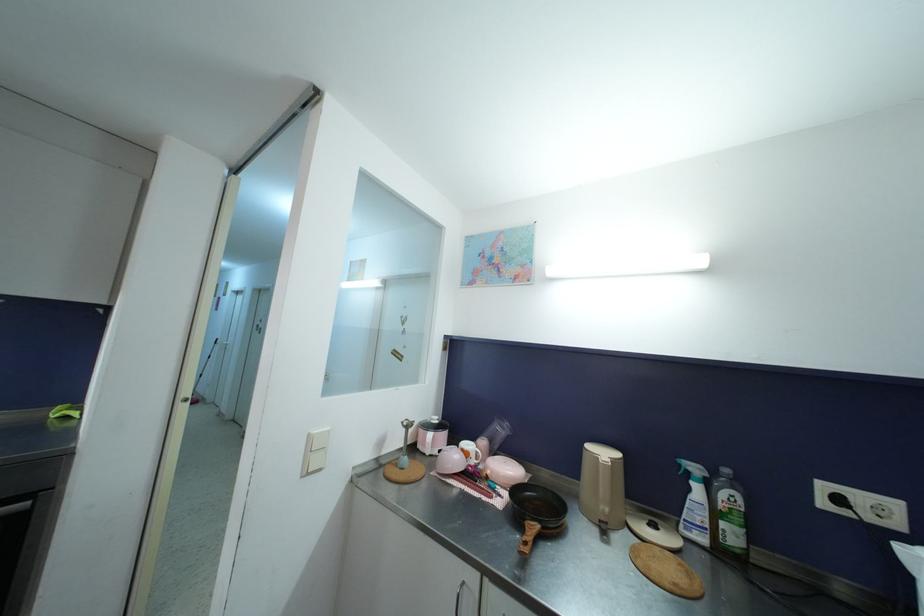
This screenshot has width=924, height=616. I want to click on pink bowl, so click(x=450, y=460).